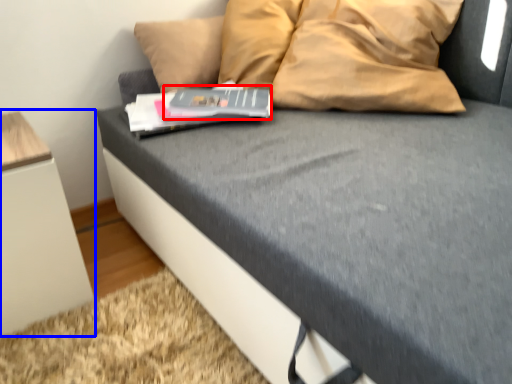
Question: Which point is closer to the camera, paperback book (highlighted by a red box) or furniture (highlighted by a blue box)?

Choices:
 (A) paperback book
 (B) furniture

Answer: (B)